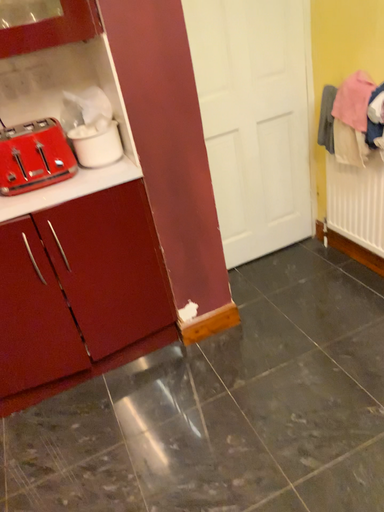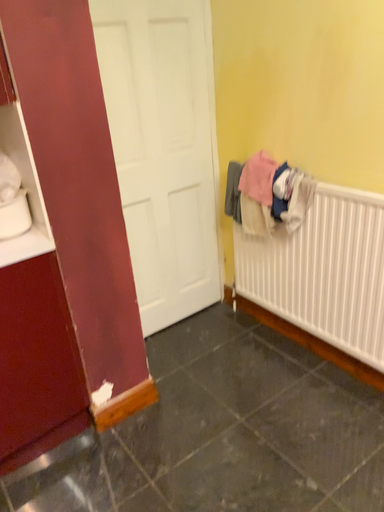
Question: Which way did the camera rotate in the video?

Choices:
 (A) rotated upward
 (B) rotated downward

Answer: (A)